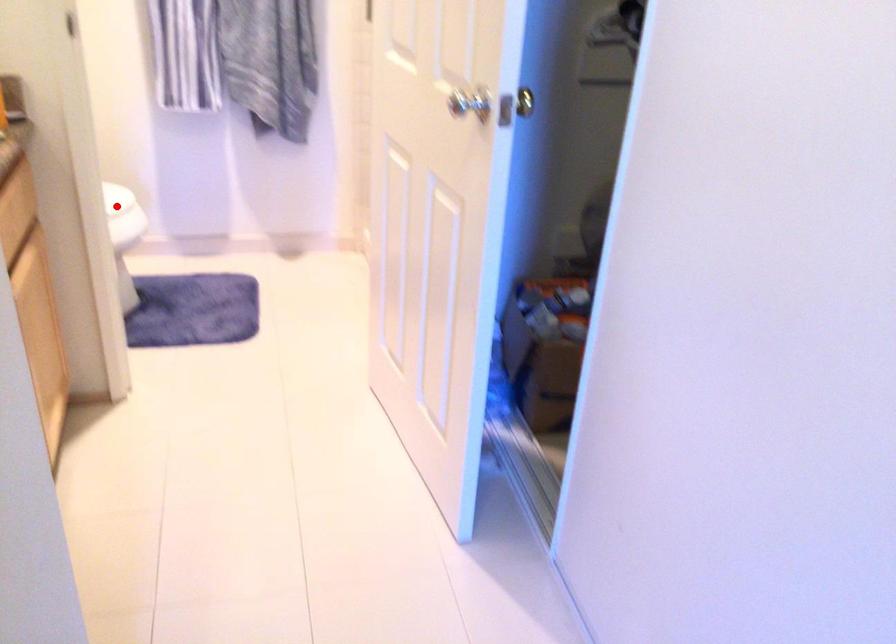
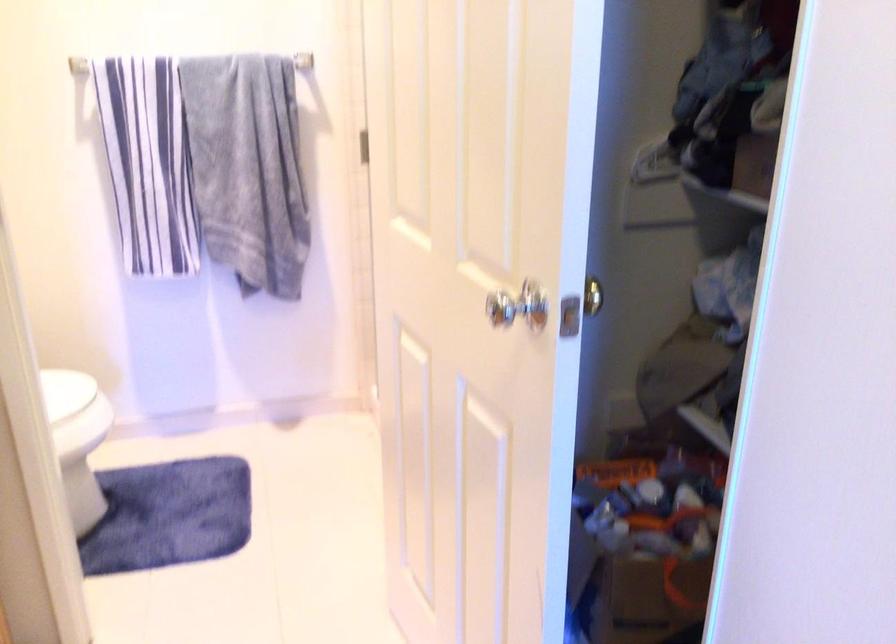
Question: I am providing you with two images of the same scene from different viewpoints. Image1 has a red point marked. In image2, the corresponding 3D location appears at what relative position? Reply with the corresponding letter.

Choices:
 (A) Closer
 (B) Farther

Answer: (A)